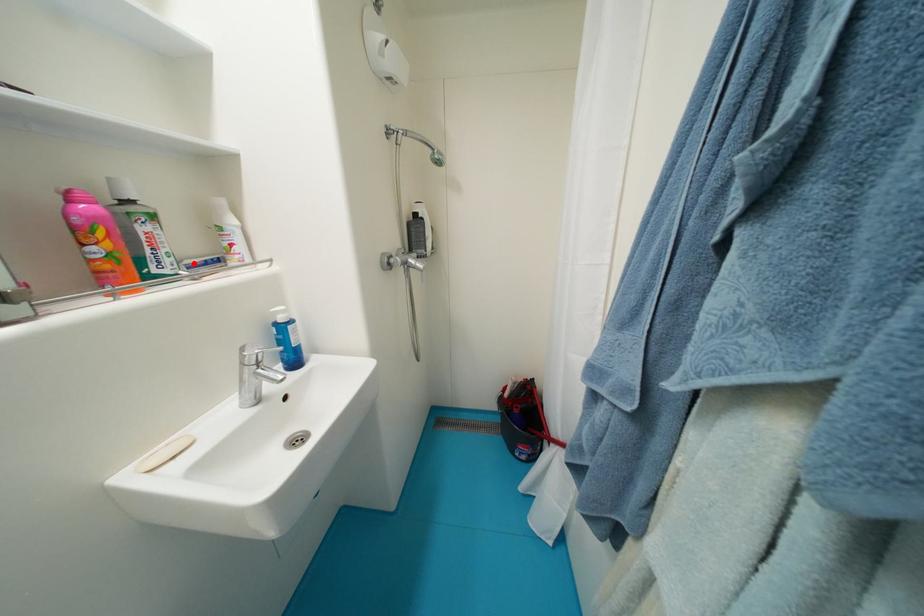
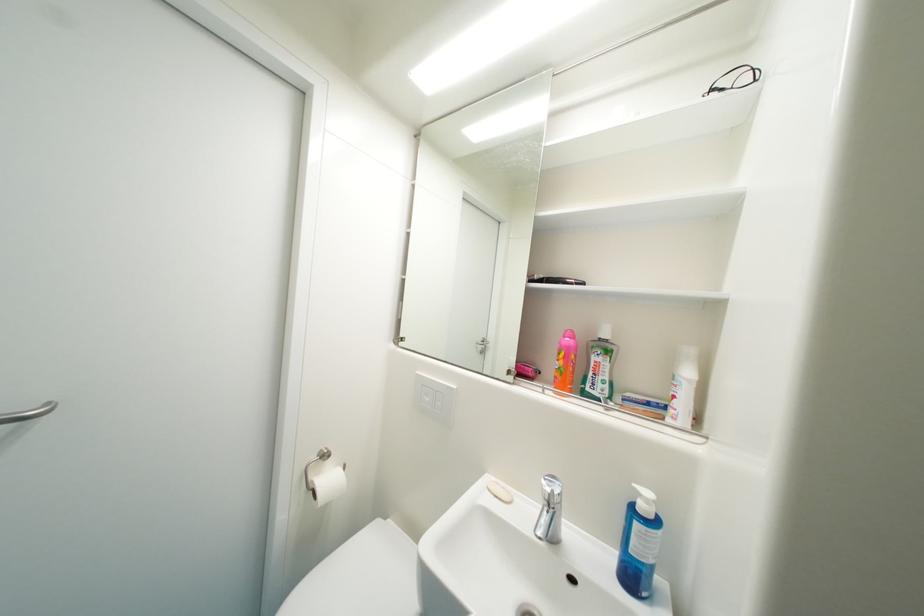
In the second image, find the point that corresponds to the highlighted location in the first image.

(635, 397)